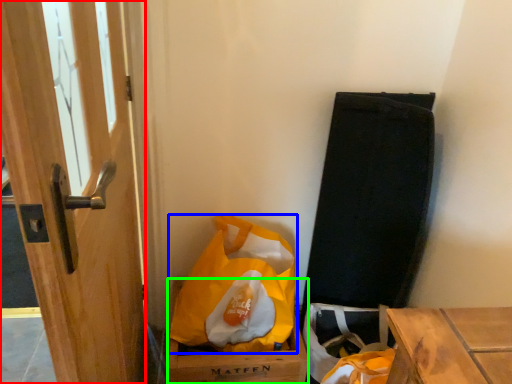
Question: Considering the real-world distances, which object is farthest from door (highlighted by a red box)? plastic bag (highlighted by a blue box) or cardboard box (highlighted by a green box)?

Choices:
 (A) plastic bag
 (B) cardboard box

Answer: (B)